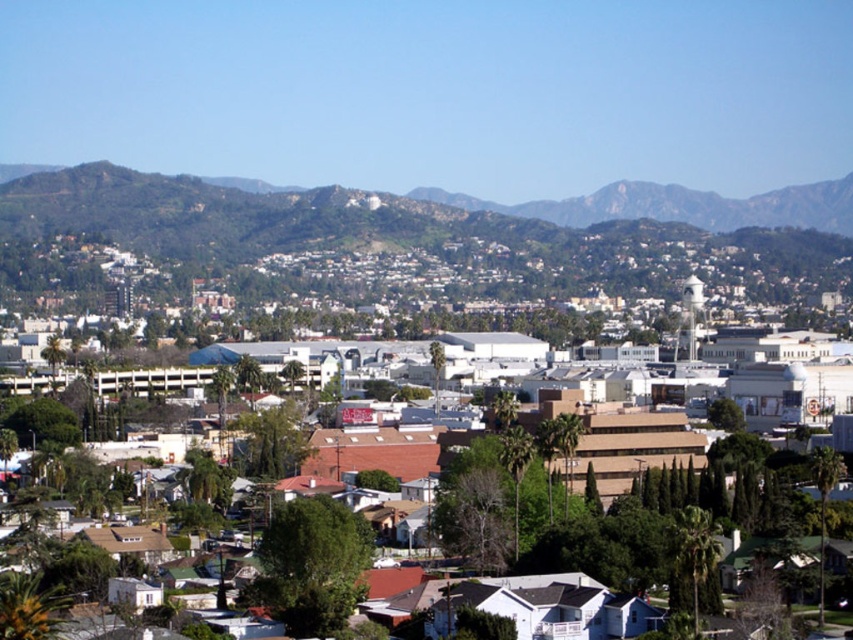
You are standing in the suburban area shown in the image. You want to walk from the green textured hillside at upper center to the brown matte building at center. Which direction should you move relative to your current position?

Since the green textured hillside at upper center is closer to you than the brown matte building at center, you should move away from the green textured hillside at upper center towards the brown matte building at center to reach it.

You are a drone operator tasked with capturing aerial footage of the suburban area. You need to ensure that both the green textured hillside at upper center and the brown matte building at center are visible in the frame. Given their relative sizes, which object should you prioritize keeping closer to the drone to maintain visibility?

The green textured hillside at upper center has a smaller size compared to brown matte building at center. To maintain visibility of both, prioritize keeping the green textured hillside at upper center closer to the drone since smaller objects need to be nearer to appear adequately sized in the footage.

Which object is located at point (235, 212)?

The green textured hillside at upper center is located at point (235, 212).